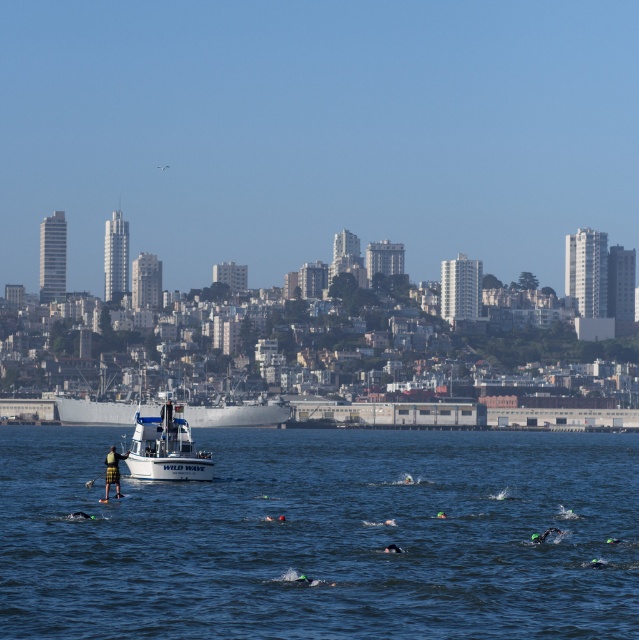
Can you confirm if blue water at center is positioned below white matte boat at center?

Yes.

What do you see at coordinates (323, 536) in the screenshot? I see `blue water at center` at bounding box center [323, 536].

What do you see at coordinates (323, 536) in the screenshot? The width and height of the screenshot is (639, 640). I see `blue water at center` at bounding box center [323, 536].

This screenshot has height=640, width=639. What are the coordinates of `blue water at center` in the screenshot? It's located at (323, 536).

Measure the distance between white matte boat at center and camera.

white matte boat at center and camera are 150.19 meters apart from each other.

Which is more to the left, white matte boat at center or green matte swim cap at lower center?

Positioned to the left is white matte boat at center.

Between point (139, 428) and point (560, 532), which one is positioned behind?

Point (139, 428)

The image size is (639, 640). I want to click on white matte boat at center, so click(166, 448).

Which is more to the left, blue water at center or green matte swim cap at lower center?

From the viewer's perspective, blue water at center appears more on the left side.

Measure the distance between point (282, 525) and camera.

A distance of 121.38 meters exists between point (282, 525) and camera.

Is point (73, 436) positioned before point (539, 534)?

No, it is behind (539, 534).

This screenshot has width=639, height=640. What are the coordinates of `blue water at center` in the screenshot? It's located at (323, 536).